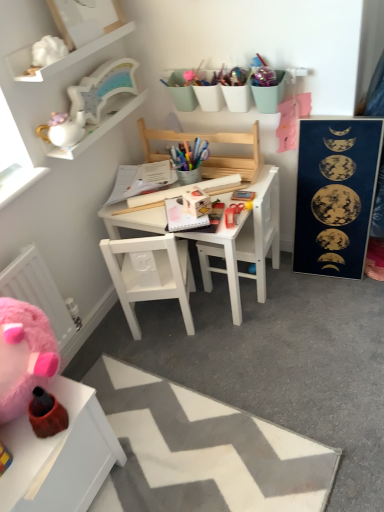
Where is `vacant area that lies between white matte chair at center, acting as the 2th chair starting from the top, and white zigzag rug at lower center`? This screenshot has height=512, width=384. vacant area that lies between white matte chair at center, acting as the 2th chair starting from the top, and white zigzag rug at lower center is located at coordinates (232, 362).